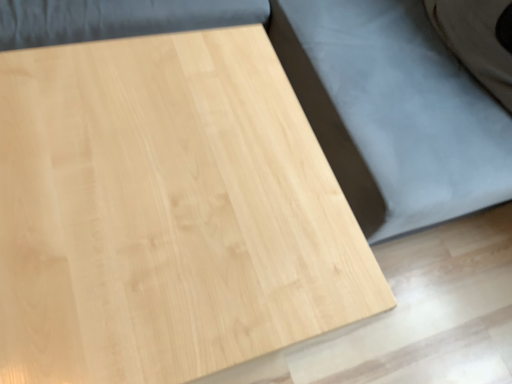
This screenshot has height=384, width=512. In order to click on natural wood bed frame at center in this screenshot , I will do `click(394, 112)`.

What do you see at coordinates (394, 112) in the screenshot? The height and width of the screenshot is (384, 512). I see `natural wood bed frame at center` at bounding box center [394, 112].

What do you see at coordinates (166, 212) in the screenshot? I see `light wood table at center` at bounding box center [166, 212].

In order to face light wood table at center, should I rotate leftwards or rightwards?

To face it directly, rotate left by 14.707 degrees.

This screenshot has height=384, width=512. I want to click on light wood table at center, so click(x=166, y=212).

Find the location of `natural wood bed frame at center`. natural wood bed frame at center is located at coordinates (394, 112).

Which is more to the right, light wood table at center or natural wood bed frame at center?

natural wood bed frame at center is more to the right.

Which object is more forward, light wood table at center or natural wood bed frame at center?

Positioned in front is light wood table at center.

Which is less distant, (x=244, y=223) or (x=393, y=230)?

Point (x=244, y=223) appears to be closer to the viewer than point (x=393, y=230).

From the image's perspective, relative to natural wood bed frame at center, is light wood table at center above or below?

Based on their image positions, light wood table at center is located beneath natural wood bed frame at center.

From a real-world perspective, is light wood table at center physically located above or below natural wood bed frame at center?

light wood table at center is situated lower than natural wood bed frame at center in the real world.

Does light wood table at center have a greater width compared to natural wood bed frame at center?

In fact, light wood table at center might be narrower than natural wood bed frame at center.

Can you confirm if light wood table at center is taller than natural wood bed frame at center?

No.

Which of these two, light wood table at center or natural wood bed frame at center, is bigger?

natural wood bed frame at center.

Is natural wood bed frame at center surrounded by light wood table at center?

Actually, natural wood bed frame at center is outside light wood table at center.

Does light wood table at center touch natural wood bed frame at center?

They are not placed beside each other.

Is light wood table at center oriented away from natural wood bed frame at center?

No.

In the scene shown: How far apart are light wood table at center and natural wood bed frame at center?

They are 15.26 inches apart.

This screenshot has height=384, width=512. I want to click on table lying below the natural wood bed frame at center (from the image's perspective), so click(x=166, y=212).

Visually, is natural wood bed frame at center positioned to the left or to the right of light wood table at center?

natural wood bed frame at center is to the right of light wood table at center.

Who is more distant, natural wood bed frame at center or light wood table at center?

Positioned behind is natural wood bed frame at center.

Considering the positions of points (295, 16) and (89, 162), is point (295, 16) farther from camera compared to point (89, 162)?

Yes, it is.

From the image's perspective, is natural wood bed frame at center above or below light wood table at center?

natural wood bed frame at center is situated higher than light wood table at center in the image.

From a real-world perspective, relative to light wood table at center, is natural wood bed frame at center vertically above or below?

natural wood bed frame at center is situated higher than light wood table at center in the real world.

Which of these two, natural wood bed frame at center or light wood table at center, is thinner?

With smaller width is light wood table at center.

Which of these two, natural wood bed frame at center or light wood table at center, stands taller?

With more height is natural wood bed frame at center.

Who is smaller, natural wood bed frame at center or light wood table at center?

With smaller size is light wood table at center.

Is natural wood bed frame at center inside or outside of light wood table at center?

natural wood bed frame at center exists outside the volume of light wood table at center.

In the scene shown: Is natural wood bed frame at center placed right next to light wood table at center?

natural wood bed frame at center and light wood table at center are clearly separated.

From the picture: Is natural wood bed frame at center oriented towards light wood table at center?

Yes, natural wood bed frame at center faces towards light wood table at center.

Can you tell me how much natural wood bed frame at center and light wood table at center differ in facing direction?

They differ by 89.5 degrees in their facing directions.

In the scene shown: Measure the distance between natural wood bed frame at center and light wood table at center.

A distance of 15.26 inches exists between natural wood bed frame at center and light wood table at center.

Locate an element on the screen. The width and height of the screenshot is (512, 384). bed frame above the light wood table at center (from a real-world perspective) is located at coordinates (394, 112).

Locate an element on the screen. table located in front of the natural wood bed frame at center is located at coordinates (166, 212).

Locate an element on the screen. The width and height of the screenshot is (512, 384). bed frame behind the light wood table at center is located at coordinates (394, 112).